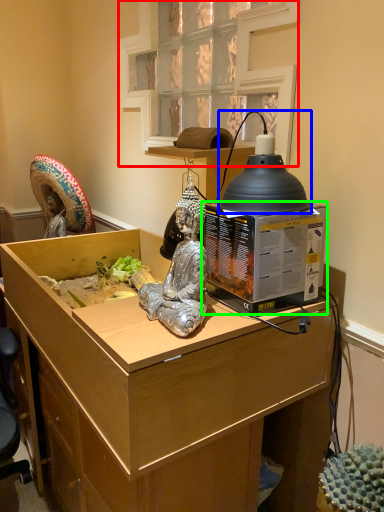
Question: Which is nearer to the window (highlighted by a red box)? lamp (highlighted by a blue box) or box (highlighted by a green box).

Choices:
 (A) lamp
 (B) box

Answer: (A)